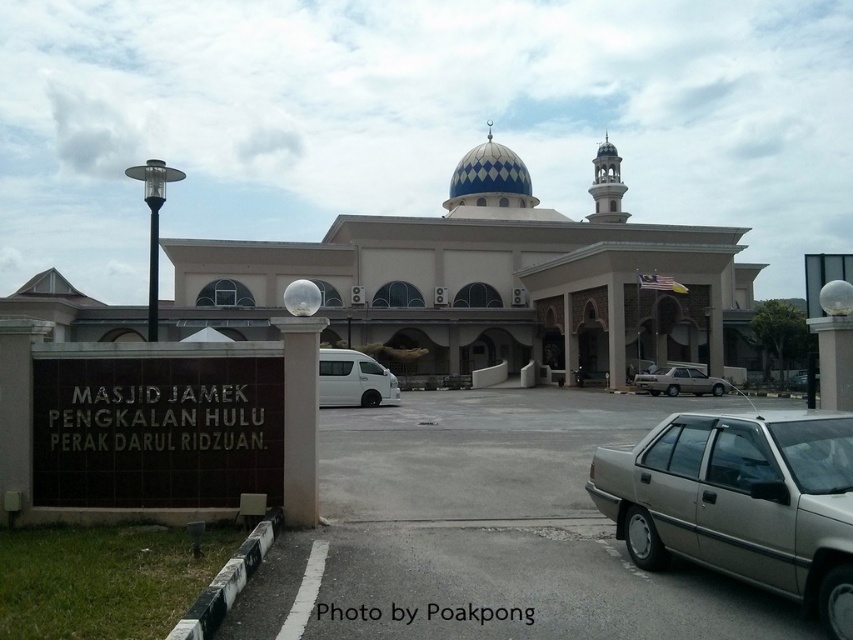
Question: Which is nearer to the white matte van at center?

Choices:
 (A) satin beige sedan at lower right
 (B) metallic silver sedan at lower right
 (C) blue glossy dome at center
 (D) gray asphalt parking lot at center

Answer: (D)

Question: Does gray asphalt parking lot at center appear over white matte van at center?

Choices:
 (A) no
 (B) yes

Answer: (A)

Question: Is gray asphalt parking lot at center positioned before metallic silver sedan at lower right?

Choices:
 (A) yes
 (B) no

Answer: (A)

Question: Which point is closer to the camera?

Choices:
 (A) blue glossy dome at center
 (B) metallic silver sedan at lower right
 (C) white matte van at center

Answer: (B)

Question: Is gray asphalt parking lot at center to the right of satin beige sedan at lower right from the viewer's perspective?

Choices:
 (A) yes
 (B) no

Answer: (B)

Question: Among these objects, which one is nearest to the camera?

Choices:
 (A) metallic silver sedan at lower right
 (B) satin beige sedan at lower right
 (C) white matte van at center

Answer: (A)